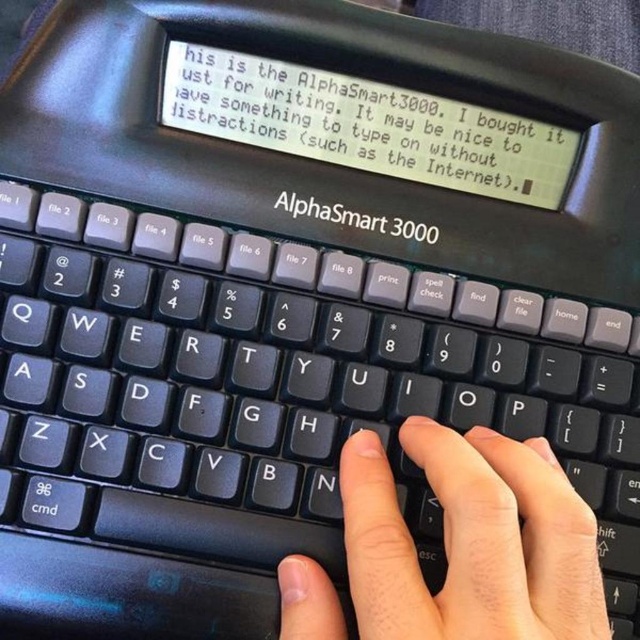
You are a user trying to type on the AlphaSmart 3000. You notice the black plastic keyboard at center and the skinny white hand at center. Which object is positioned higher in the image?

The black plastic keyboard at center is located above the skinny white hand at center, so the black plastic keyboard at center is positioned higher in the image.

You are holding a ruler and want to measure the distance between the two points in the image. Which point is closer to you, point [8,547] or point [465,436]?

Point [8,547] is closer to the viewer than point [465,436].